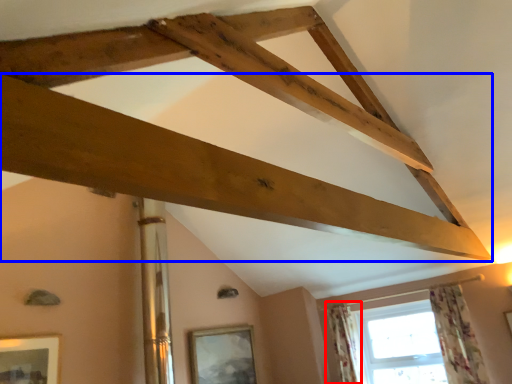
Question: Which object is closer to the camera taking this photo, curtain (highlighted by a red box) or plank (highlighted by a blue box)?

Choices:
 (A) curtain
 (B) plank

Answer: (B)